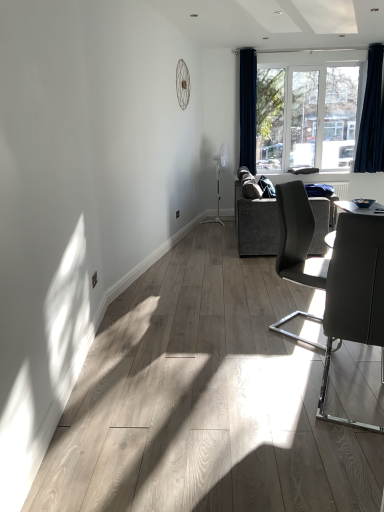
Identify the location of vacant space that is to the left of matte gray chair at right, the 1th chair in the front-to-back sequence. The width and height of the screenshot is (384, 512). (270, 395).